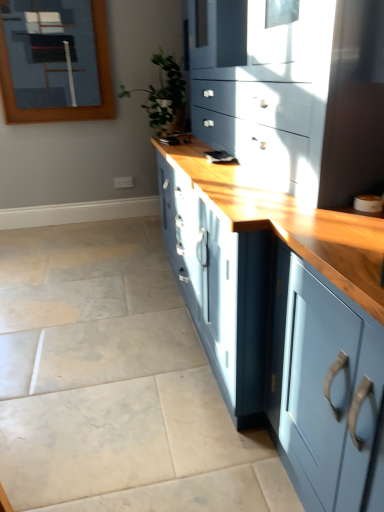
Image resolution: width=384 pixels, height=512 pixels. In order to click on free region on the left part of matte blue cabinet at center in this screenshot , I will do `click(84, 304)`.